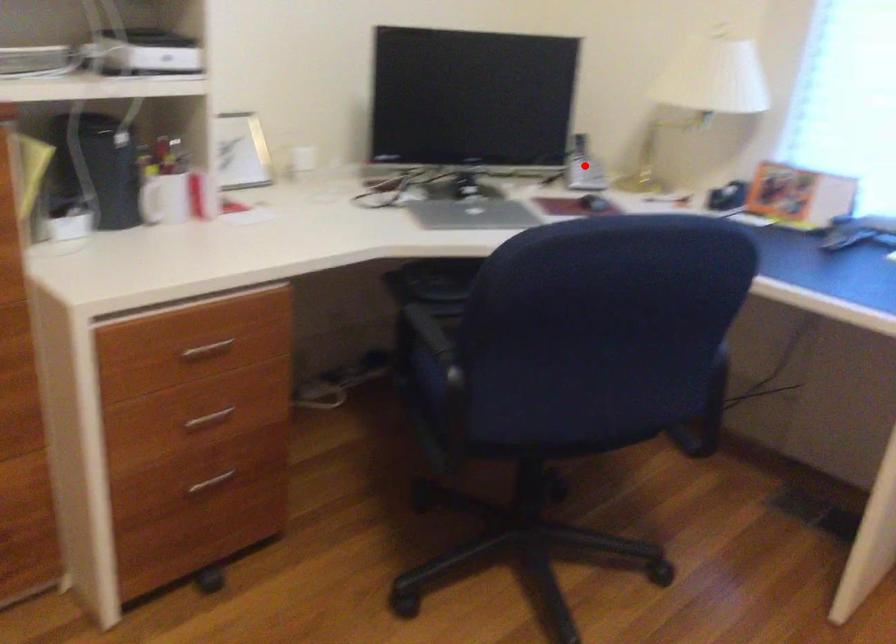
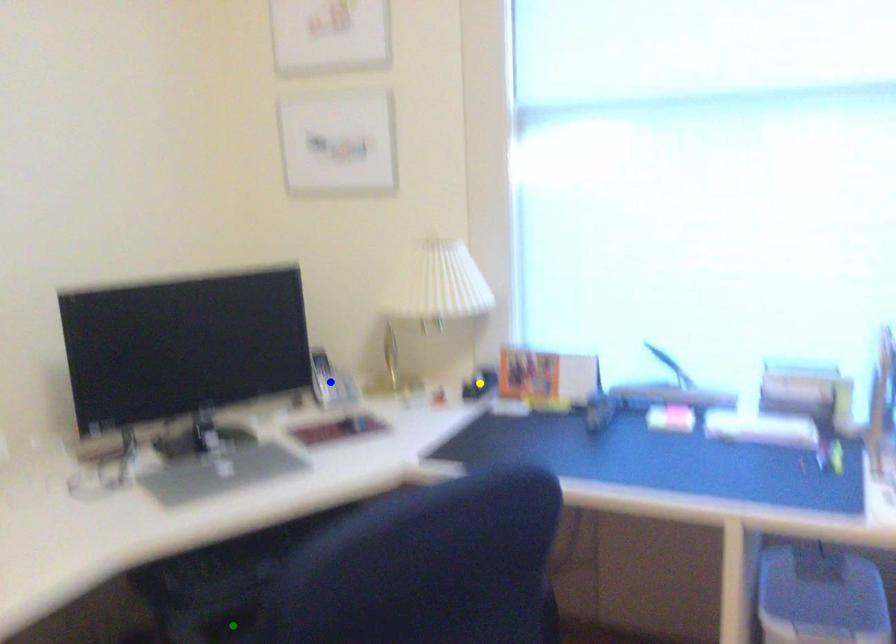
Question: I am providing you with two images of the same scene from different viewpoints. A red point is marked on the first image. You are given multiple points on the second image. Which spot in image 2 lines up with the point in image 1?

Choices:
 (A) green point
 (B) yellow point
 (C) blue point

Answer: (C)